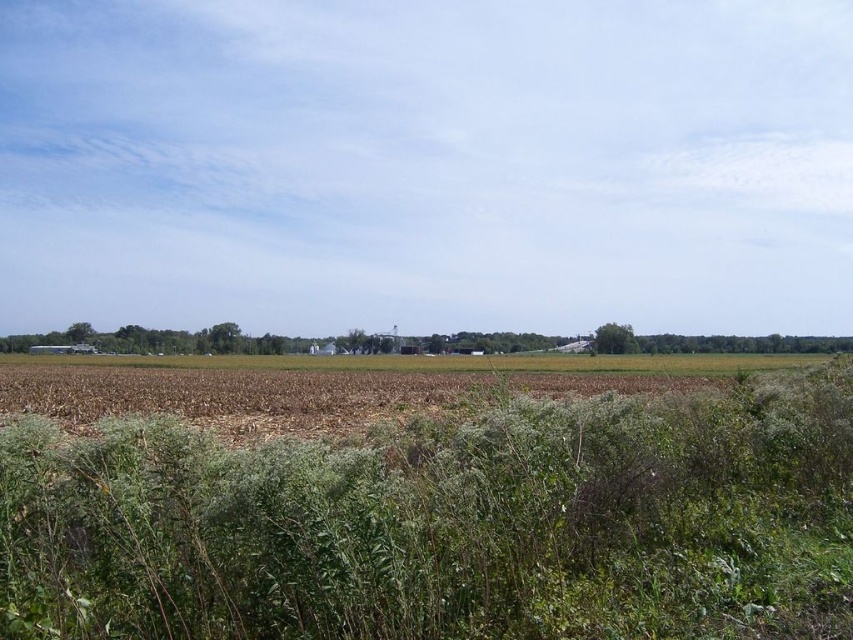
Question: Which of the following is the farthest from the observer?

Choices:
 (A) green grass at center
 (B) green grassy vegetation at center

Answer: (A)

Question: Can you confirm if green grassy vegetation at center is smaller than green grass at center?

Choices:
 (A) yes
 (B) no

Answer: (A)

Question: Does green grassy vegetation at center appear on the left side of green grass at center?

Choices:
 (A) yes
 (B) no

Answer: (B)

Question: Can you confirm if green grassy vegetation at center is wider than green grass at center?

Choices:
 (A) yes
 (B) no

Answer: (B)